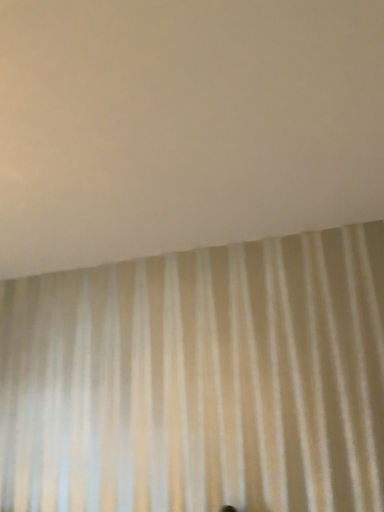
The image size is (384, 512). What do you see at coordinates (184, 125) in the screenshot?
I see `white sheer curtain at upper center` at bounding box center [184, 125].

This screenshot has height=512, width=384. Find the location of `white sheer curtain at upper center`. white sheer curtain at upper center is located at coordinates (184, 125).

Locate an element on the screen. The height and width of the screenshot is (512, 384). white sheer curtain at upper center is located at coordinates (184, 125).